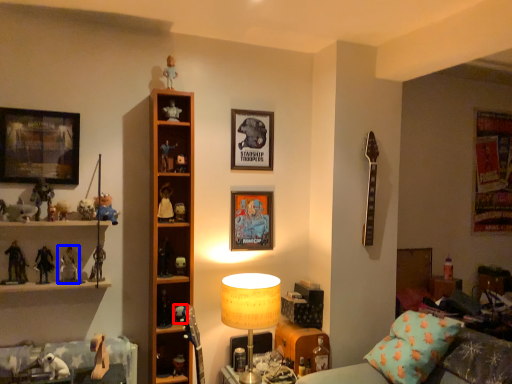
Question: Which object appears farthest to the camera in this image, toy (highlighted by a red box) or toy (highlighted by a blue box)?

Choices:
 (A) toy
 (B) toy

Answer: (A)